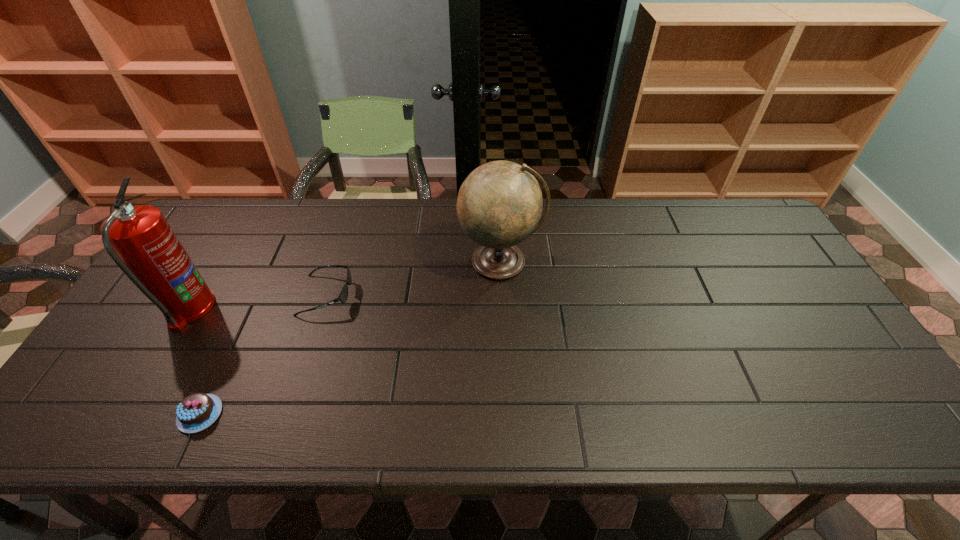
Image resolution: width=960 pixels, height=540 pixels. Find the location of `the leftmost object`. the leftmost object is located at coordinates (139, 240).

Where is `globe`? globe is located at coordinates (499, 204).

This screenshot has width=960, height=540. Find the location of `the second object from right to left`. the second object from right to left is located at coordinates click(x=343, y=295).

Locate an element on the screen. The width and height of the screenshot is (960, 540). the nearest object is located at coordinates (196, 412).

I want to click on chocolate cake, so click(196, 412).

Where is `free space located 0.240m on the instruction side of the leftmost object`? Image resolution: width=960 pixels, height=540 pixels. free space located 0.240m on the instruction side of the leftmost object is located at coordinates (300, 309).

You are a GUI agent. You are given a task and a screenshot of the screen. Output one action in this format:
    pyautogui.click(x=<x>, y=<y>)
    Task: Click on the free space located on the front-facing side of the rightmost object
    Image resolution: width=960 pixels, height=540 pixels.
    Given the screenshot: What is the action you would take?
    pyautogui.click(x=505, y=360)

This screenshot has width=960, height=540. In order to click on vacant space situated on the front-facing side of the second object from right to left in this screenshot , I will do `click(388, 295)`.

At what (x,y) coordinates should I click in order to perform the action: click on blank space located on the back of the third object from right to left. Please return your answer as a coordinate pair (x, y). Looking at the image, I should click on (232, 345).

Locate an element on the screen. The width and height of the screenshot is (960, 540). object positioned at the far edge is located at coordinates (499, 204).